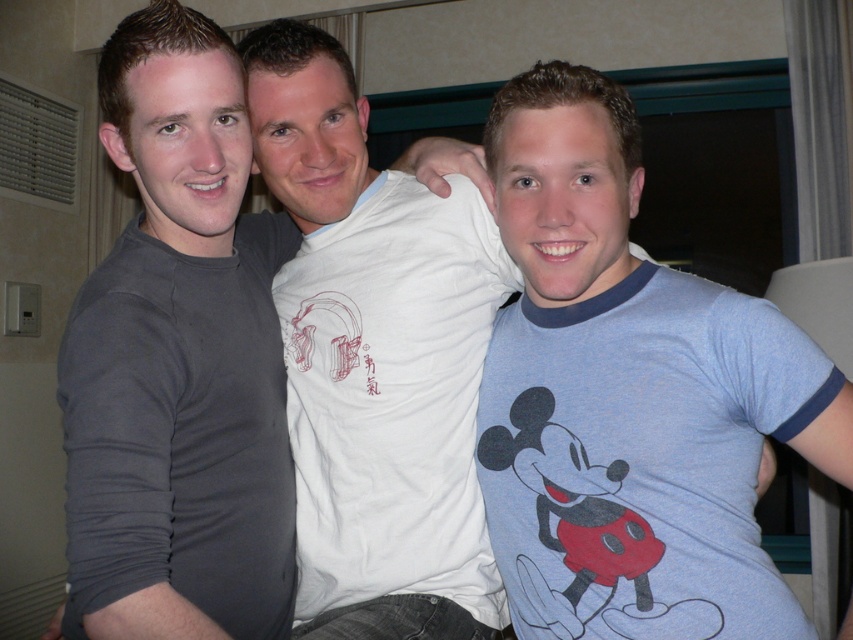
Who is positioned more to the left, white cotton t-shirt at center or dark gray long-sleeve shirt at left?

dark gray long-sleeve shirt at left is more to the left.

Who is more forward, (401, 268) or (263, 433)?

Point (263, 433) is more forward.

At what (x,y) coordinates should I click in order to perform the action: click on white cotton t-shirt at center. Please return your answer as a coordinate pair (x, y). Looking at the image, I should click on (376, 358).

Is point (729, 515) closer to viewer compared to point (433, 304)?

Yes.

Can you confirm if blue heathered t-shirt at center is positioned to the left of white cotton t-shirt at center?

In fact, blue heathered t-shirt at center is to the right of white cotton t-shirt at center.

This screenshot has width=853, height=640. What do you see at coordinates (630, 396) in the screenshot?
I see `blue heathered t-shirt at center` at bounding box center [630, 396].

Find the location of `blue heathered t-shirt at center`. blue heathered t-shirt at center is located at coordinates (630, 396).

Locate an element on the screen. The width and height of the screenshot is (853, 640). blue heathered t-shirt at center is located at coordinates (630, 396).

Is blue heathered t-shirt at center to the left of dark gray long-sleeve shirt at left from the viewer's perspective?

Incorrect, blue heathered t-shirt at center is not on the left side of dark gray long-sleeve shirt at left.

Does point (612, 84) come closer to viewer compared to point (248, 316)?

Yes.

Identify the location of blue heathered t-shirt at center. The height and width of the screenshot is (640, 853). (630, 396).